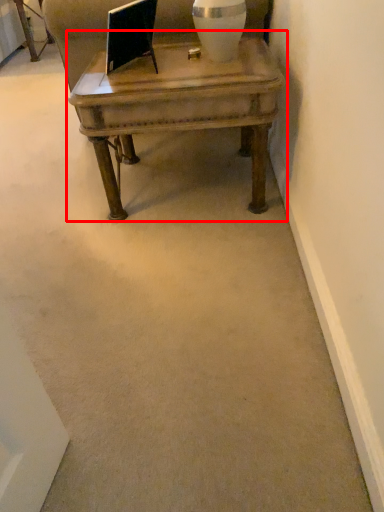
Question: From the image's perspective, what is the correct spatial relationship of coffee table (annotated by the red box) in relation to vase?

Choices:
 (A) above
 (B) below

Answer: (B)